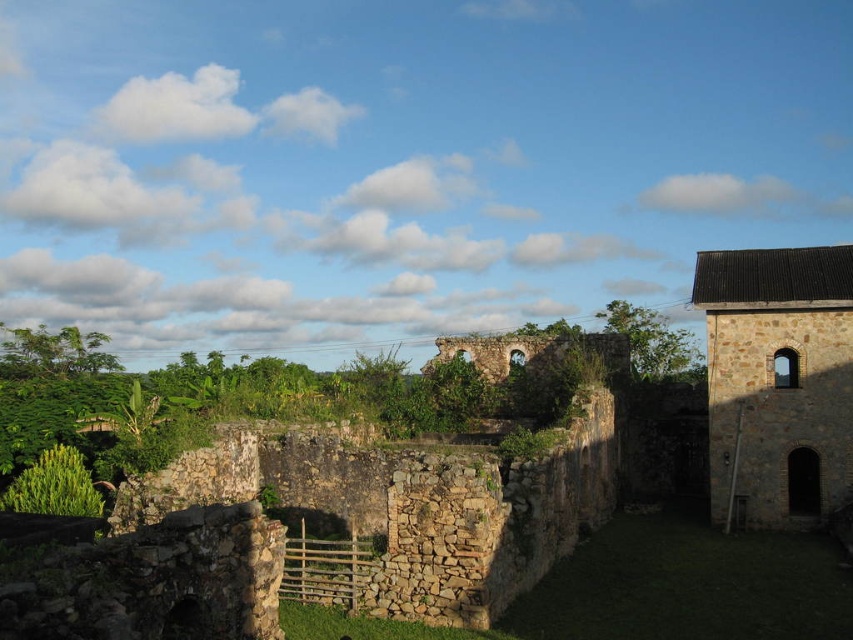
Based on the photo, you are standing in the historical stone area and want to place a small statue between the brown stone tower at right and the green leafy bush at lower left. Based on their positions, where should you place the statue so it is between them?

The brown stone tower at right is above the green leafy bush at lower left, so to place the statue between them, position it in the middle area between the lower left and the upper right, ensuring it is horizontally aligned between the two objects.

Consider the image. You are standing at the center of the image and want to walk towards the brown stone tower at right. Which direction should you head relative to the green leafy bush at lower left?

The brown stone tower at right is to the right of the green leafy bush at lower left. Therefore, you should head to the right relative to the green leafy bush at lower left to reach the brown stone tower at right.

You are a hiker who has just arrived at this historical site. You need to place a 100 feet long protective barrier between the brown stone tower at right and the green leafy bush at lower left to prevent erosion. Is the distance sufficient for this purpose?

The brown stone tower at right is 117.95 feet from the green leafy bush at lower left, so yes, the distance is sufficient to place a 100 feet long protective barrier between them.